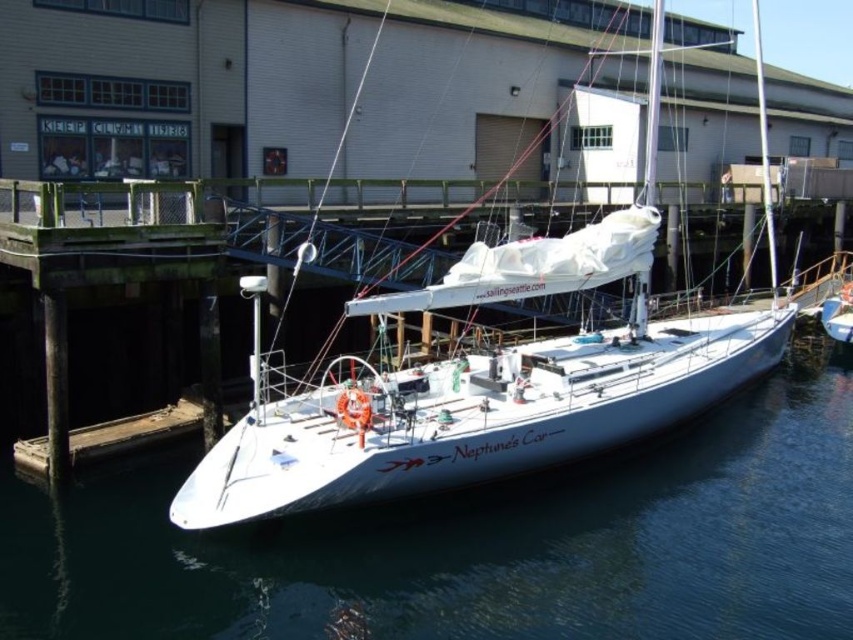
You are a marine biologist who needs to place a buoy 1 meter away from the white glossy sailboat at center. Given the coordinates provided, where should you place the buoy?

The white glossy sailboat at center is located at coordinates point (488, 378). To place the buoy 1 meter away from it, you should position it at point (488, 378) plus or minus 1 meter in any direction, depending on the desired placement direction.

You are a crane operator tasked with lifting the white glossy sailboat at center and the wooden dock at lower left onto a truck. Which object should you lift first to avoid any collision with the other during the process?

You should lift the white glossy sailboat at center first because it is taller than the wooden dock at lower left. Lifting the taller object first ensures that when you raise it, there will be no interference with the shorter wooden dock at lower left during the lifting process.

You are standing on the wooden dock at lower left and want to see the clear water at center. In which direction should you look?

You should look forward, as the clear water at center is in front of the wooden dock at lower left.